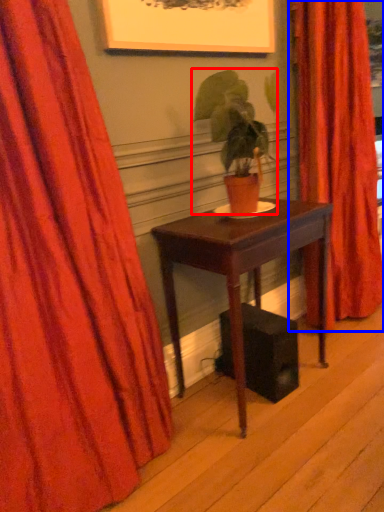
Question: Which object is closer to the camera taking this photo, houseplant (highlighted by a red box) or curtain (highlighted by a blue box)?

Choices:
 (A) houseplant
 (B) curtain

Answer: (A)